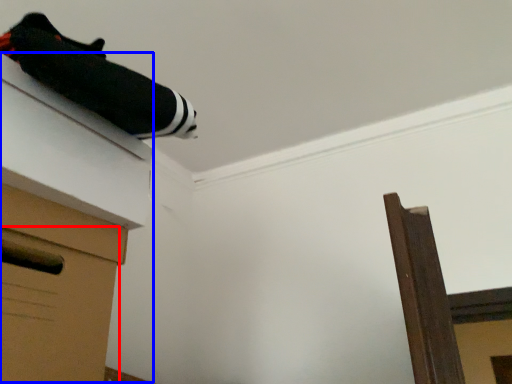
Question: Among these objects, which one is farthest to the camera, drawer (highlighted by a red box) or vanity (highlighted by a blue box)?

Choices:
 (A) drawer
 (B) vanity

Answer: (B)